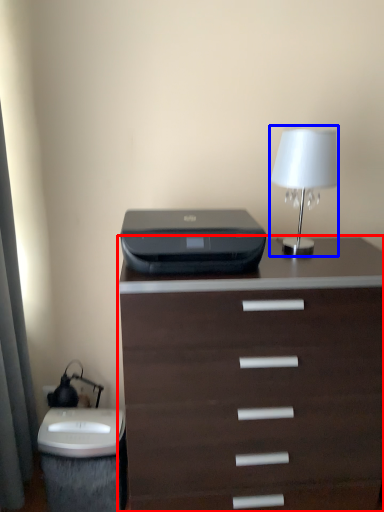
Question: Among these objects, which one is nearest to the camera, chest of drawers (highlighted by a red box) or bedside lamp (highlighted by a blue box)?

Choices:
 (A) chest of drawers
 (B) bedside lamp

Answer: (A)